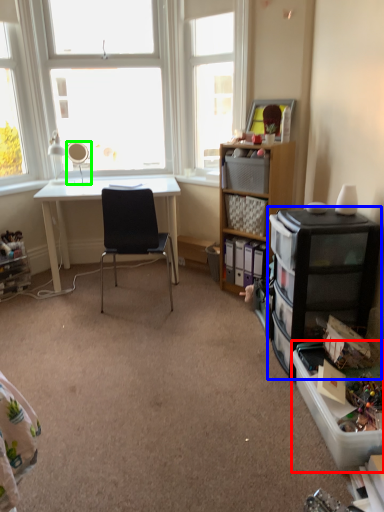
Question: Which is nearer to the storage box (highlighted by a red box)? cabinetry (highlighted by a blue box) or mirror (highlighted by a green box).

Choices:
 (A) cabinetry
 (B) mirror

Answer: (A)